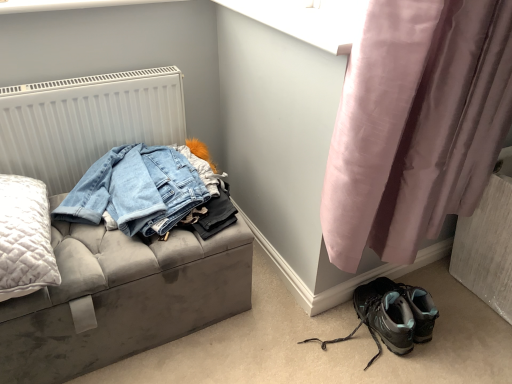
Question: Is matte black hiking boots at lower right taller than velvet grey storage bench at left?

Choices:
 (A) no
 (B) yes

Answer: (A)

Question: Can you confirm if matte black hiking boots at lower right is wider than velvet grey storage bench at left?

Choices:
 (A) yes
 (B) no

Answer: (B)

Question: From the image's perspective, is matte black hiking boots at lower right under velvet grey storage bench at left?

Choices:
 (A) no
 (B) yes

Answer: (B)

Question: Does matte black hiking boots at lower right have a larger size compared to velvet grey storage bench at left?

Choices:
 (A) yes
 (B) no

Answer: (B)

Question: Considering the relative positions of matte black hiking boots at lower right and velvet grey storage bench at left in the image provided, is matte black hiking boots at lower right to the left of velvet grey storage bench at left from the viewer's perspective?

Choices:
 (A) yes
 (B) no

Answer: (B)

Question: Is matte black hiking boots at lower right bigger or smaller than white textured radiator at upper left?

Choices:
 (A) big
 (B) small

Answer: (B)

Question: Considering their positions, is matte black hiking boots at lower right located in front of or behind white textured radiator at upper left?

Choices:
 (A) behind
 (B) front

Answer: (B)

Question: Considering the relative positions of matte black hiking boots at lower right and white textured radiator at upper left in the image provided, is matte black hiking boots at lower right to the left or to the right of white textured radiator at upper left?

Choices:
 (A) right
 (B) left

Answer: (A)

Question: From a real-world perspective, relative to white textured radiator at upper left, is matte black hiking boots at lower right vertically above or below?

Choices:
 (A) below
 (B) above

Answer: (A)

Question: From a real-world perspective, is white textured radiator at upper left above or below velvet grey storage bench at left?

Choices:
 (A) below
 (B) above

Answer: (B)

Question: Does point (25, 152) appear closer or farther from the camera than point (140, 254)?

Choices:
 (A) closer
 (B) farther

Answer: (B)

Question: Would you say white textured radiator at upper left is inside or outside velvet grey storage bench at left?

Choices:
 (A) outside
 (B) inside

Answer: (A)

Question: Relative to velvet grey storage bench at left, is white textured radiator at upper left in front or behind?

Choices:
 (A) front
 (B) behind

Answer: (B)

Question: From the image's perspective, is matte black hiking boots at lower right positioned above or below pink satin curtain at lower right?

Choices:
 (A) above
 (B) below

Answer: (B)

Question: Is matte black hiking boots at lower right wider or thinner than pink satin curtain at lower right?

Choices:
 (A) wide
 (B) thin

Answer: (A)